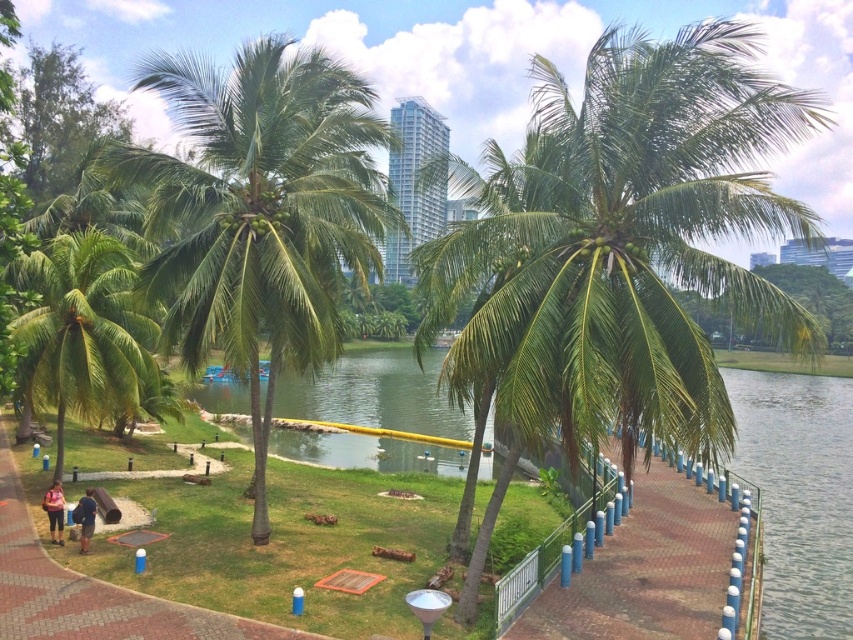
You are a gardener planning to water the green leafy coconut tree at center and the green leafy palm tree at lower left. Since you can only reach up to 1.5 meters, which tree might be easier to water without needing a ladder?

The green leafy coconut tree at center is in front of the green leafy palm tree at lower left, so it might be closer to you. Since you can reach up to 1.5 meters, the coconut tree at center would be easier to water without a ladder if it is within your reach.

You are standing at the edge of the park pathway and want to take a photo of the green leafy coconut tree at center. If your camera has a zoom lens that can focus on objects within a 0.3 radius around a specific point, what point should you aim for to capture the tree in the best possible focus?

You should aim your camera at the point with coordinates (619,248) to ensure the green leafy coconut tree at center is in sharp focus, as this is the tree location according to the scene description.

You are a gardener who needs to move a heavy wheelbarrow from the brown brick path at lower left to the brick paved walkway at center. Considering the distance between them, can you estimate whether you can push the wheelbarrow directly from one to the other without needing to detour around any obstacles?

The brick paved walkway at center is 30.76 feet away from the brown brick path at lower left. Since there are no obstacles mentioned in the scene description, you can push the wheelbarrow directly between the brown brick path at lower left and the brick paved walkway at center without needing to detour.